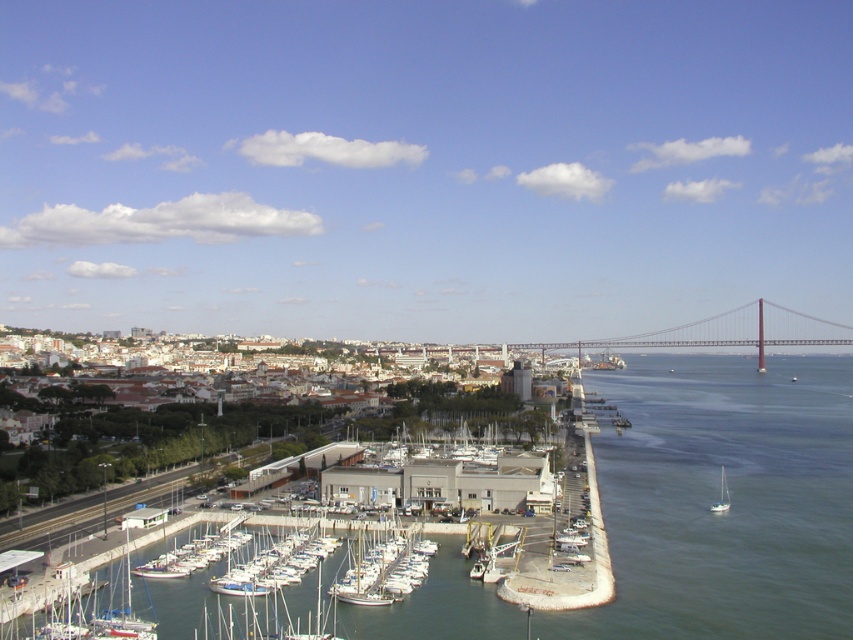
Between white wooden sailboat at center and white matte sailboat at lower right, which one appears on the left side from the viewer's perspective?

white wooden sailboat at center is more to the left.

Which of these two, white wooden sailboat at center or white matte sailboat at lower right, stands taller?

white wooden sailboat at center is taller.

Between point (352, 573) and point (727, 508), which one is positioned in front?

Point (352, 573)

At what (x,y) coordinates should I click in order to perform the action: click on white wooden sailboat at center. Please return your answer as a coordinate pair (x, y). This screenshot has height=640, width=853. Looking at the image, I should click on (384, 572).

The width and height of the screenshot is (853, 640). Identify the location of white wooden sailboat at center. click(x=384, y=572).

Which is more to the right, white wooden sailboat at center or white matte sailboat at lower left?

From the viewer's perspective, white wooden sailboat at center appears more on the right side.

Does point (389, 556) come behind point (120, 637)?

Yes, point (389, 556) is behind point (120, 637).

Image resolution: width=853 pixels, height=640 pixels. I want to click on white wooden sailboat at center, so click(x=384, y=572).

Which is behind, point (126, 621) or point (721, 509)?

The point (721, 509) is behind.

Which is more to the left, white matte sailboat at lower left or white matte sailboat at lower right?

From the viewer's perspective, white matte sailboat at lower left appears more on the left side.

Is point (119, 621) positioned in front of point (718, 504)?

Yes, it is in front of point (718, 504).

Locate an element on the screen. white matte sailboat at lower left is located at coordinates (122, 618).